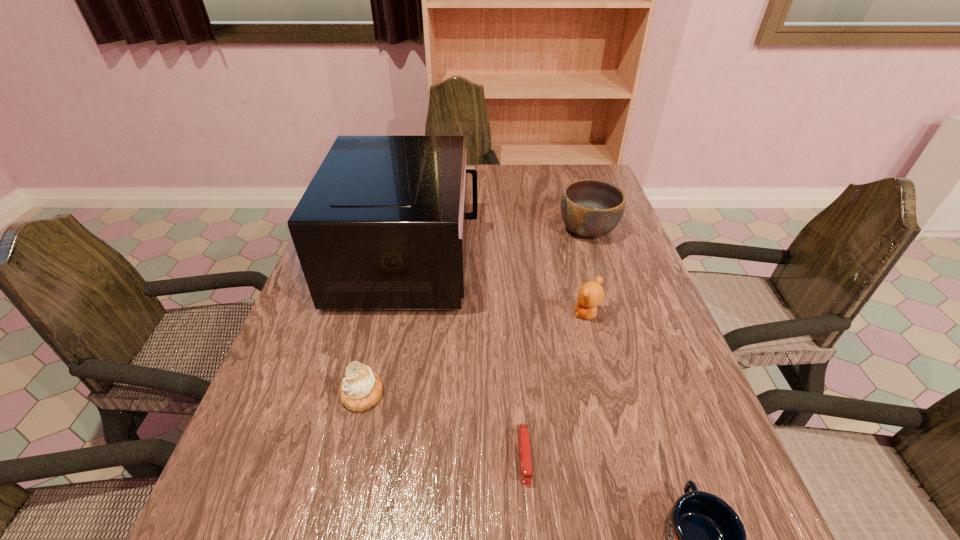
This screenshot has height=540, width=960. I want to click on the tallest object, so click(x=382, y=225).

Find the location of a particular element. The width and height of the screenshot is (960, 540). bowl is located at coordinates (591, 208).

In order to click on the fourth shortest object in this screenshot , I will do `click(591, 294)`.

Locate an element on the screen. This screenshot has height=540, width=960. the fourth farthest object is located at coordinates (361, 388).

At what (x,y) coordinates should I click in order to perform the action: click on pastry. Please return your answer as a coordinate pair (x, y). This screenshot has height=540, width=960. Looking at the image, I should click on (361, 388).

Locate an element on the screen. The height and width of the screenshot is (540, 960). the second nearest object is located at coordinates pyautogui.click(x=523, y=434).

The width and height of the screenshot is (960, 540). Identify the location of stapler. coord(523,434).

Identify the location of vacant area situated on the front-facing side of the tallest object. (526, 259).

Where is `vacant space situated 0.310m on the left of the bowl`? vacant space situated 0.310m on the left of the bowl is located at coordinates (451, 230).

I want to click on vacant region located 0.160m on the face of the teddy bear, so click(505, 314).